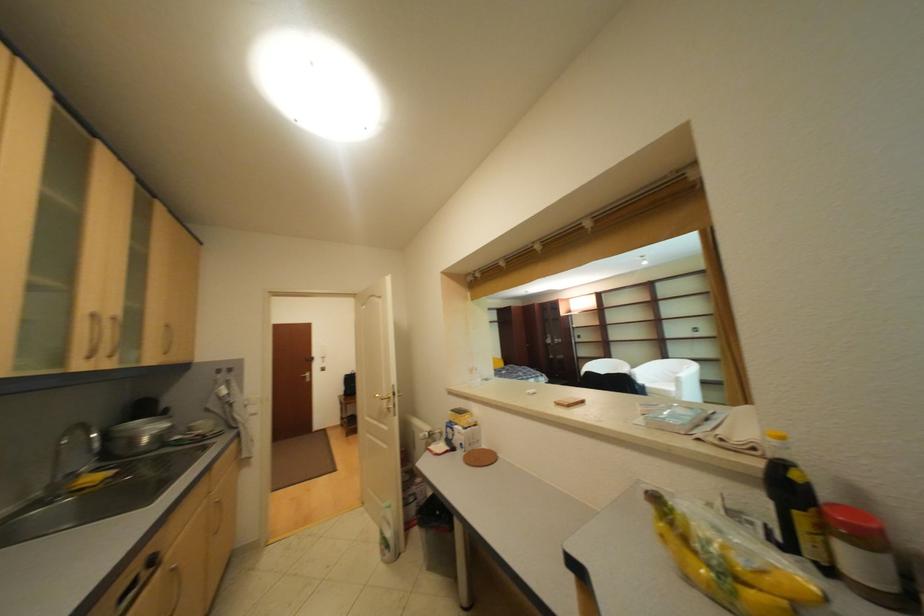
Where would you peel the yellow banana? Please return your answer as a coordinate pair (x, y).

(709, 568)